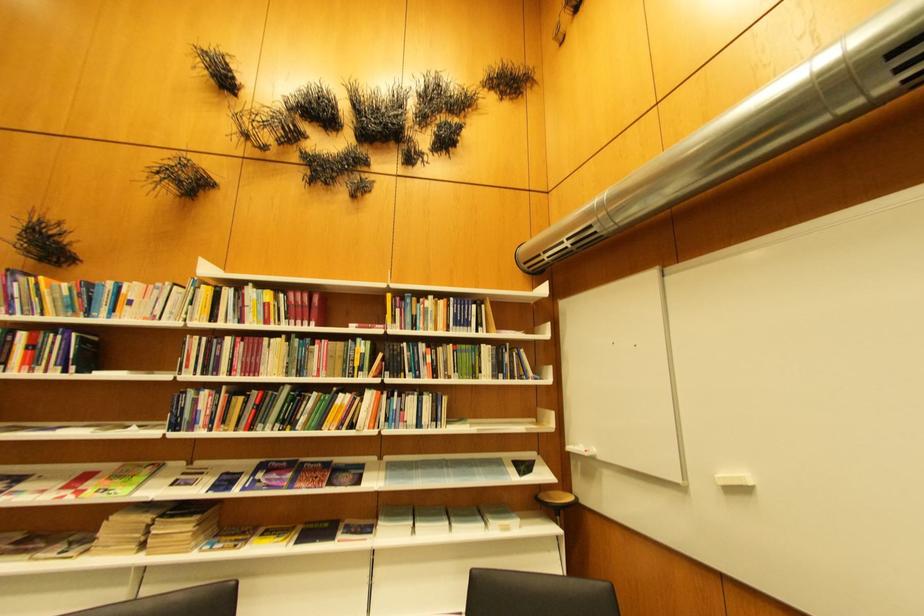
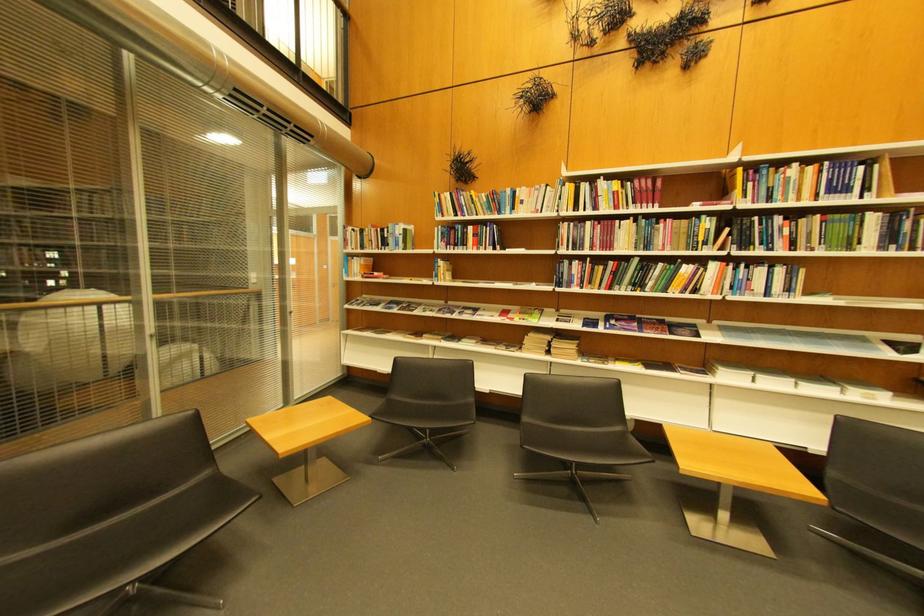
Locate, in the second image, the point that corresponds to [407,373] in the first image.

(756, 246)